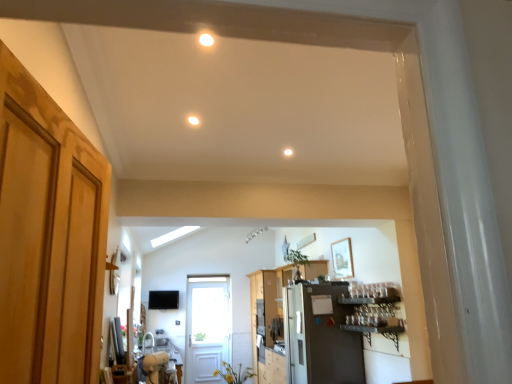
Image resolution: width=512 pixels, height=384 pixels. In order to click on free location in front of matte white light fixture at center, which is the 2th lighting in front-to-back order in this screenshot , I will do `click(195, 110)`.